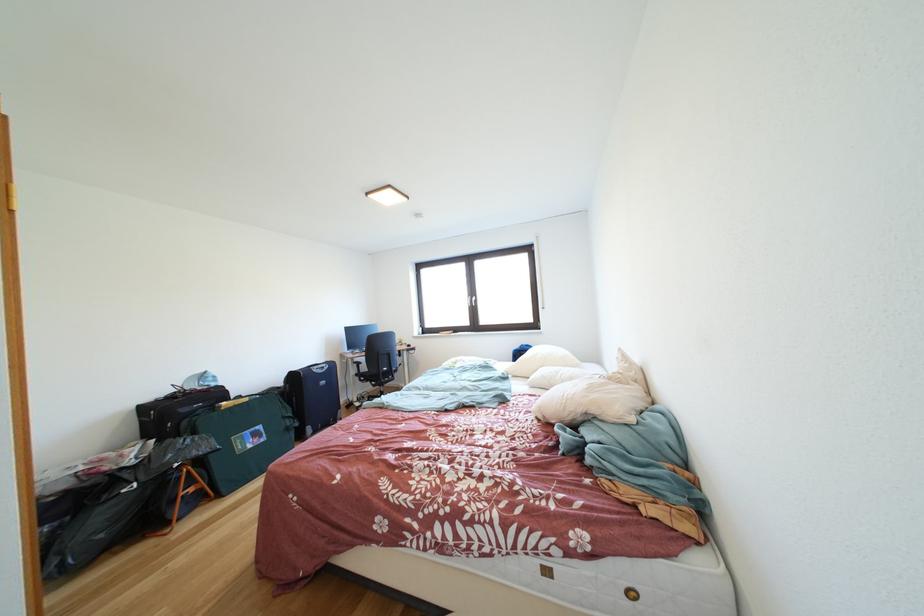
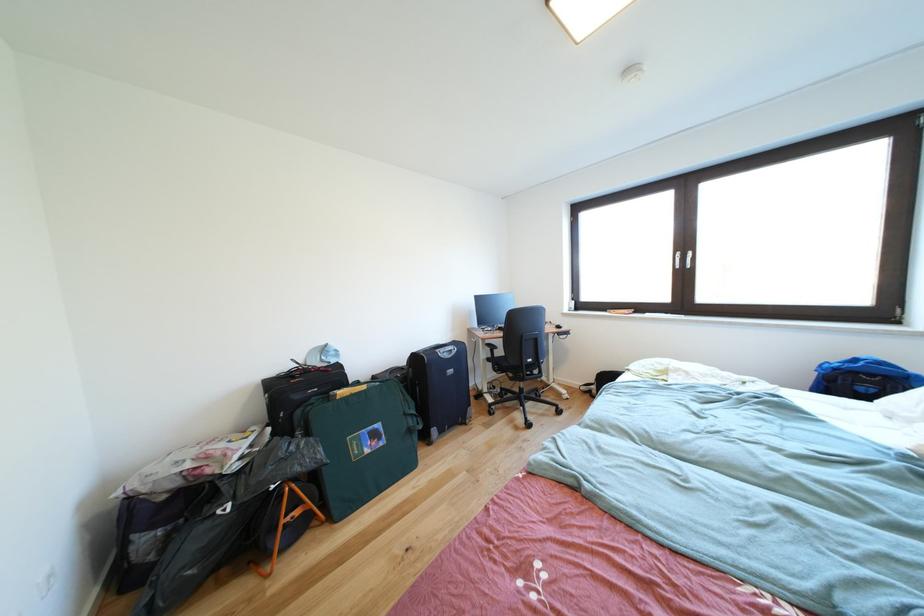
In the scene shown: What movement of the cameraman would produce the second image?

The cameraman walked toward left, forward.